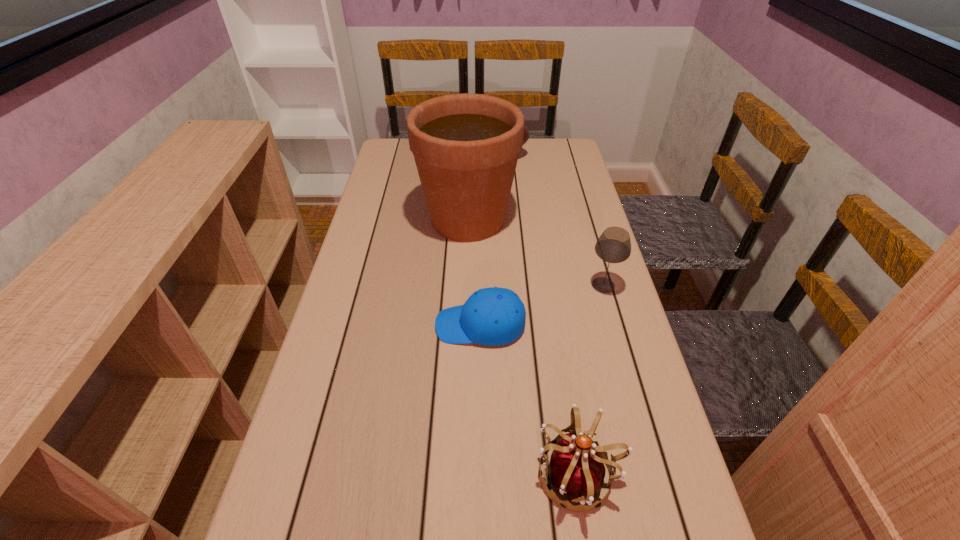
Find the location of `vacant space that satisfies the following two spatial constraints: 1. on the back side of the farthest object; 2. on the left side of the tallest object`. vacant space that satisfies the following two spatial constraints: 1. on the back side of the farthest object; 2. on the left side of the tallest object is located at coordinates point(470,156).

I want to click on free region that satisfies the following two spatial constraints: 1. on the back side of the football (American); 2. on the right side of the flowerpot, so click(x=470, y=156).